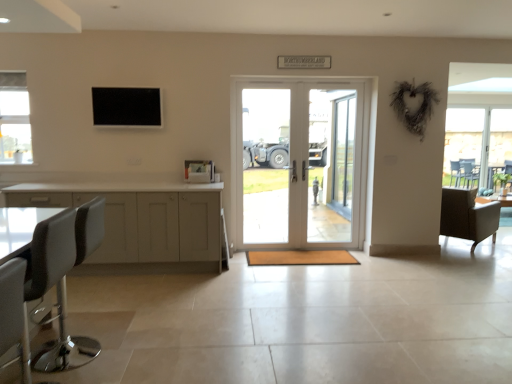
The height and width of the screenshot is (384, 512). In order to click on white matte cabinet at left in this screenshot , I will do `click(142, 221)`.

What do you see at coordinates (15, 119) in the screenshot? The height and width of the screenshot is (384, 512). I see `clear glass window at upper left` at bounding box center [15, 119].

What do you see at coordinates (331, 164) in the screenshot?
I see `clear glass door at center` at bounding box center [331, 164].

Measure the distance between clear glass door at center and camera.

clear glass door at center is 17.12 feet away from camera.

What do you see at coordinates (468, 216) in the screenshot?
I see `leather-like brown armchair at right, positioned as the 2th chair in left-to-right order` at bounding box center [468, 216].

Where is `white leather bar stool at left, positioned as the 2th chair in back-to-front order`? white leather bar stool at left, positioned as the 2th chair in back-to-front order is located at coordinates (65, 343).

Is clear glass door at center situated inside white leather bar stool at left, positioned as the 2th chair in right-to-left order, or outside?

clear glass door at center exists outside the volume of white leather bar stool at left, positioned as the 2th chair in right-to-left order.

Who is taller, clear glass door at center or white leather bar stool at left, positioned as the 2th chair in right-to-left order?

With more height is clear glass door at center.

Based on their positions, is clear glass door at center located to the left or right of white leather bar stool at left, positioned as the 2th chair in right-to-left order?

In the image, clear glass door at center appears on the right side of white leather bar stool at left, positioned as the 2th chair in right-to-left order.

Which object is positioned more to the left, black leather swivel chair at lower left or clear glass window at upper left?

clear glass window at upper left is more to the left.

Is black leather swivel chair at lower left not close to clear glass window at upper left?

That's right, there is a large distance between black leather swivel chair at lower left and clear glass window at upper left.

This screenshot has height=384, width=512. I want to click on window positioned vertically above the black leather swivel chair at lower left (from a real-world perspective), so click(x=15, y=119).

In the scene shown: Which of these two, black leather swivel chair at lower left or clear glass window at upper left, is bigger?

Bigger between the two is black leather swivel chair at lower left.

Which object is closer to the camera, white leather bar stool at left, positioned as the 2th chair in back-to-front order, or white glossy door at center?

white leather bar stool at left, positioned as the 2th chair in back-to-front order, is in front.

How different are the orientations of white leather bar stool at left, which appears as the first chair when viewed from the front, and white glossy door at center in degrees?

The angular difference between white leather bar stool at left, which appears as the first chair when viewed from the front, and white glossy door at center is 88.1 degrees.

Considering the relative sizes of white leather bar stool at left, which appears as the first chair when viewed from the front, and white glossy door at center in the image provided, is white leather bar stool at left, which appears as the first chair when viewed from the front, bigger than white glossy door at center?

Actually, white leather bar stool at left, which appears as the first chair when viewed from the front, might be smaller than white glossy door at center.

From the image's perspective, relative to white glossy door at center, is white leather bar stool at left, positioned as the 2th chair in back-to-front order, above or below?

From the image's perspective, white leather bar stool at left, positioned as the 2th chair in back-to-front order, appears below white glossy door at center.

This screenshot has width=512, height=384. I want to click on the 2nd chair below the black leather swivel chair at lower left (from a real-world perspective), so coord(468,216).

In the image, is leather-like brown armchair at right, positioned as the 2th chair in left-to-right order, on the left side or the right side of black leather swivel chair at lower left?

From the image, it's evident that leather-like brown armchair at right, positioned as the 2th chair in left-to-right order, is to the right of black leather swivel chair at lower left.

Looking at this image, which is farther, [470,239] or [42,266]?

The point [470,239] is more distant.

Could you measure the distance between leather-like brown armchair at right, positioned as the 2th chair in left-to-right order, and black leather swivel chair at lower left?

The distance of leather-like brown armchair at right, positioned as the 2th chair in left-to-right order, from black leather swivel chair at lower left is 4.97 meters.

Does point (65, 304) come behind point (350, 172)?

That is False.

Considering the sizes of white leather bar stool at left, positioned as the 2th chair in back-to-front order, and clear glass door at center in the image, is white leather bar stool at left, positioned as the 2th chair in back-to-front order, taller or shorter than clear glass door at center?

Clearly, white leather bar stool at left, positioned as the 2th chair in back-to-front order, is shorter compared to clear glass door at center.

Locate an element on the screen. screen door above the white leather bar stool at left, positioned as the 2th chair in right-to-left order (from a real-world perspective) is located at coordinates (331, 164).

Could you measure the distance between white leather bar stool at left, positioned as the 2th chair in right-to-left order, and clear glass door at center?

white leather bar stool at left, positioned as the 2th chair in right-to-left order, is 3.44 meters away from clear glass door at center.

From the image's perspective, which is below, white glossy door at center or leather-like brown armchair at right, the first chair from the back?

leather-like brown armchair at right, the first chair from the back, appears lower in the image.

Which object is further away from the camera, white glossy door at center or leather-like brown armchair at right, which appears as the second chair when viewed from the front?

leather-like brown armchair at right, which appears as the second chair when viewed from the front, is more distant.

Is black leather swivel chair at lower left turned away from white matte cabinet at left?

That's not correct — black leather swivel chair at lower left is not looking away from white matte cabinet at left.

Can you confirm if black leather swivel chair at lower left is smaller than white matte cabinet at left?

Indeed, black leather swivel chair at lower left has a smaller size compared to white matte cabinet at left.

Between black leather swivel chair at lower left and white matte cabinet at left, which one has larger width?

white matte cabinet at left.

Does black leather swivel chair at lower left have a greater height compared to white matte cabinet at left?

Yes.

Identify the location of screen door behind the white leather bar stool at left, positioned as the 2th chair in back-to-front order. The height and width of the screenshot is (384, 512). (331, 164).

This screenshot has height=384, width=512. What are the coordinates of `window above the black leather swivel chair at lower left (from a real-world perspective)` in the screenshot? It's located at click(x=15, y=119).

When comparing their distances from leather-like brown armchair at right, positioned as the 2th chair in left-to-right order, does white glossy door at center or clear glass window at upper left seem further?

Among the two, clear glass window at upper left is located further to leather-like brown armchair at right, positioned as the 2th chair in left-to-right order.

When comparing their distances from white matte cabinet at left, does white glossy door at center or clear glass door at center seem further?

The object further to white matte cabinet at left is clear glass door at center.

Based on the photo, estimate the real-world distances between objects in this image. Which object is further from white glossy door at center, clear glass door at center or white leather bar stool at left, positioned as the 1th chair in left-to-right order?

Among the two, white leather bar stool at left, positioned as the 1th chair in left-to-right order, is located further to white glossy door at center.

When comparing their distances from white leather bar stool at left, which appears as the first chair when viewed from the front, does clear glass door at center or leather-like brown armchair at right, the first chair from the back, seem further?

The object further to white leather bar stool at left, which appears as the first chair when viewed from the front, is leather-like brown armchair at right, the first chair from the back.

Considering their positions, is black leather swivel chair at lower left positioned further to clear glass door at center than white glossy door at center?

black leather swivel chair at lower left is positioned further to the anchor clear glass door at center.

When comparing their distances from clear glass window at upper left, does black leather swivel chair at lower left or white matte cabinet at left seem further?

black leather swivel chair at lower left is positioned further to the anchor clear glass window at upper left.

Considering their positions, is white glossy door at center positioned further to white leather bar stool at left, positioned as the 2th chair in right-to-left order, than clear glass door at center?

clear glass door at center.

Considering their positions, is clear glass window at upper left positioned closer to white matte cabinet at left than white glossy door at center?

clear glass window at upper left is closer to white matte cabinet at left.

Where is `cabinetry between clear glass window at upper left and white glossy door at center in the horizontal direction`? cabinetry between clear glass window at upper left and white glossy door at center in the horizontal direction is located at coordinates [x=142, y=221].

Identify the location of screen door between black leather swivel chair at lower left and leather-like brown armchair at right, the first chair from the back. The height and width of the screenshot is (384, 512). (331, 164).

In order to click on cabinetry between black leather swivel chair at lower left and clear glass door at center from front to back in this screenshot , I will do `click(142, 221)`.

Find the location of `swivel chair situated between clear glass window at upper left and clear glass door at center from left to right`. swivel chair situated between clear glass window at upper left and clear glass door at center from left to right is located at coordinates [x=51, y=253].